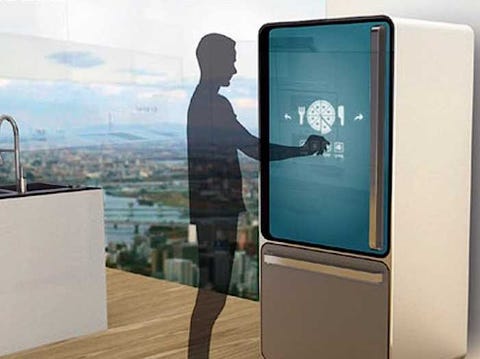
The height and width of the screenshot is (359, 480). What are the coordinates of `fork` in the screenshot? It's located at (301, 112).